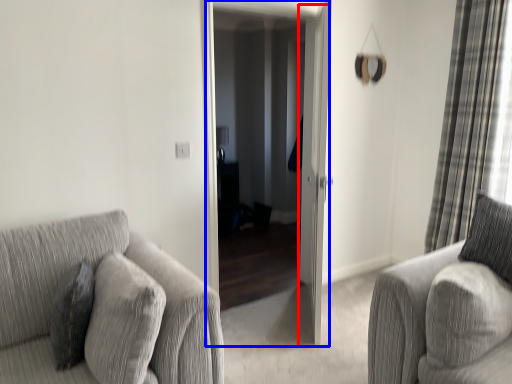
Question: Which object appears closest to the camera in this image, screen door (highlighted by a red box) or screen door (highlighted by a blue box)?

Choices:
 (A) screen door
 (B) screen door

Answer: (A)